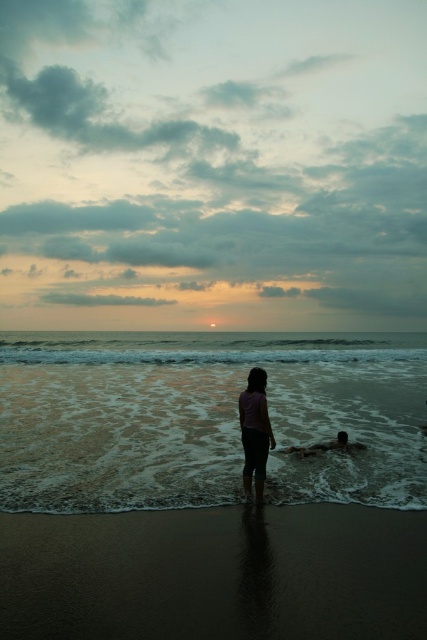
Question: Does dark brown sand at lower center come in front of pink fabric at center?

Choices:
 (A) no
 (B) yes

Answer: (B)

Question: Does dark brown sand at lower center have a greater width compared to smooth skin person at lower center?

Choices:
 (A) no
 (B) yes

Answer: (B)

Question: Considering the real-world distances, which object is closest to the pink fabric at center?

Choices:
 (A) smooth skin person at lower center
 (B) dark brown sand at lower center

Answer: (B)

Question: Does dark brown sand at lower center appear over pink fabric at center?

Choices:
 (A) no
 (B) yes

Answer: (A)

Question: Which of the following is the farthest from the observer?

Choices:
 (A) pink fabric at center
 (B) dark brown sand at lower center

Answer: (A)

Question: Estimate the real-world distances between objects in this image. Which object is closer to the dark brown sand at lower center?

Choices:
 (A) pink fabric at center
 (B) smooth skin person at lower center

Answer: (A)